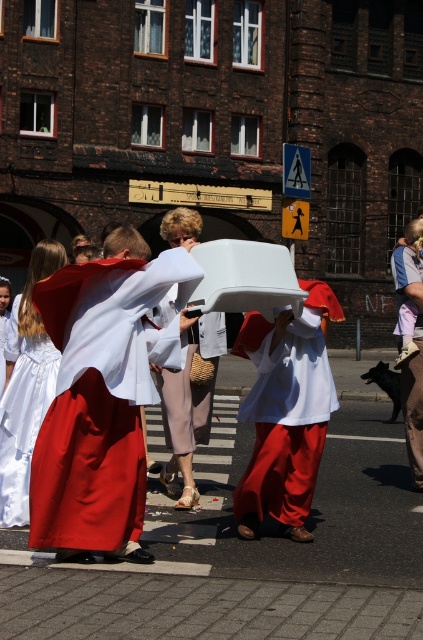
You are a photographer trying to capture the light beige fabric pants at center in the scene. Based on their position, where should you aim your camera to ensure they are centered in the frame?

To center the light beige fabric pants at center in the frame, aim your camera at point 0.633 on the horizontal axis and 0.447 on the vertical axis, as that is their exact location in the scene.